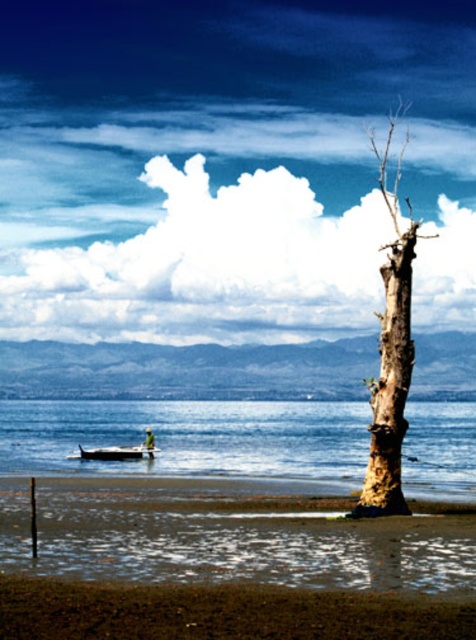
You are planning to build a small sandcastle on the brown sandy beach at lower center. Considering the size of the beach, will there be enough space for the sandcastle and the metallic silver boat at lower left to be placed side by side without overlapping?

The brown sandy beach at lower center is narrower than the metallic silver boat at lower left, so there might not be enough space to place them side by side without overlapping.